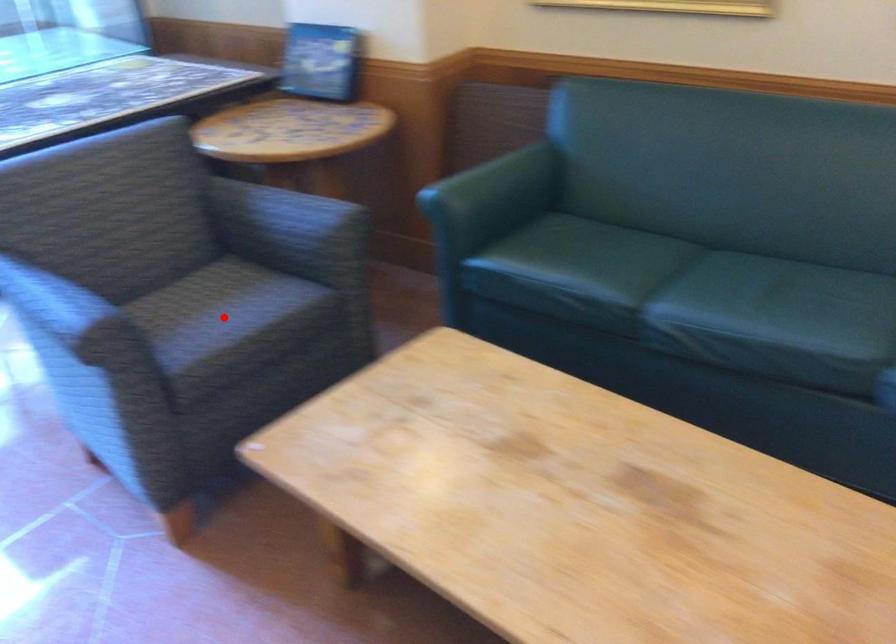
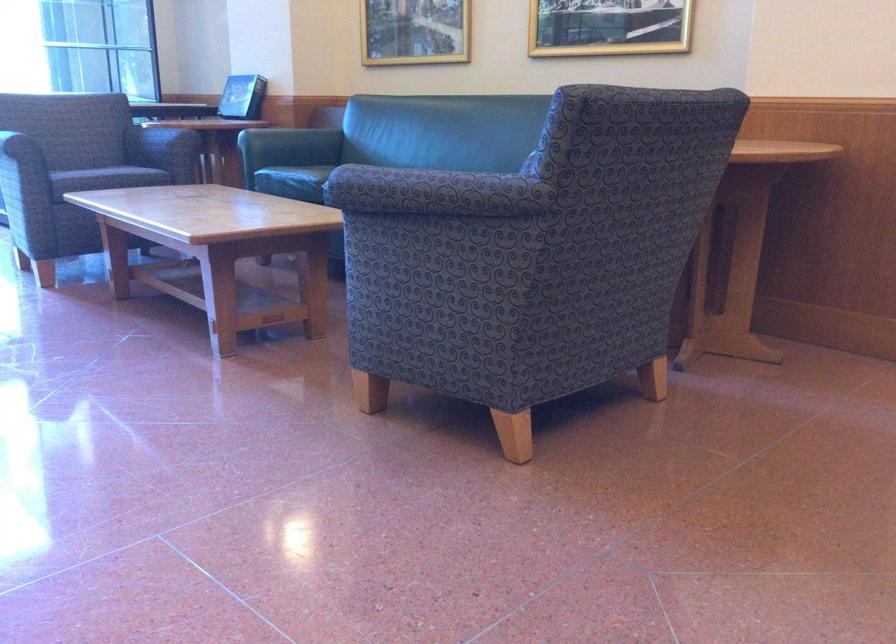
Question: I am providing you with two images of the same scene from different viewpoints. A red point is marked on the first image. Can you still see the location of the red point in image 2?

Choices:
 (A) Yes
 (B) No

Answer: (B)